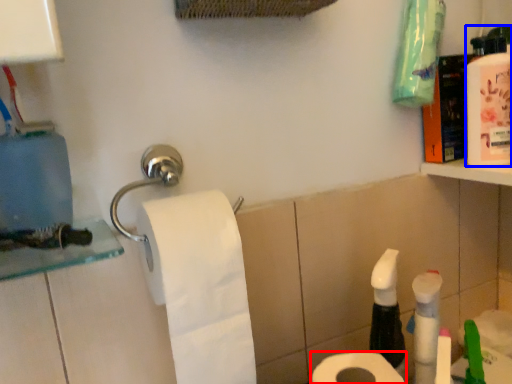
Question: Which object appears closest to the camera in this image, toilet paper (highlighted by a red box) or mouthwash (highlighted by a blue box)?

Choices:
 (A) toilet paper
 (B) mouthwash

Answer: (A)